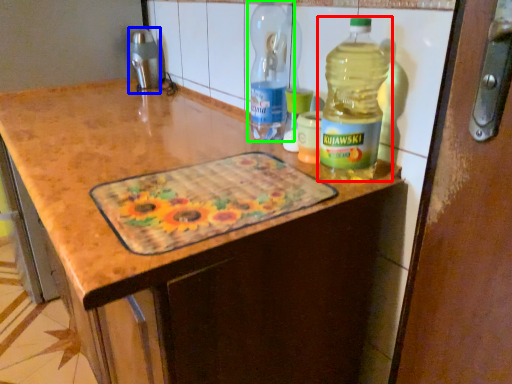
Question: Considering the real-world distances, which object is closest to bottle (highlighted by a red box)? appliance (highlighted by a blue box) or bottle (highlighted by a green box).

Choices:
 (A) appliance
 (B) bottle

Answer: (B)